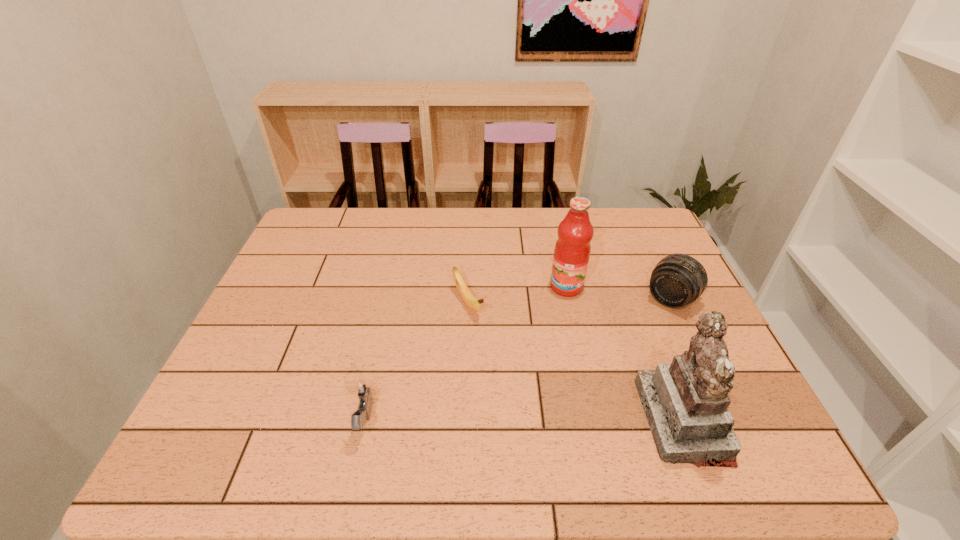
Find the location of a particular element. This screenshot has width=960, height=540. vacant region at the far right corner of the desktop is located at coordinates (627, 245).

The image size is (960, 540). I want to click on vacant space at the near right corner, so click(751, 420).

Where is `vacant area that lies between the third tallest object and the leftmost object`? This screenshot has height=540, width=960. vacant area that lies between the third tallest object and the leftmost object is located at coordinates (517, 361).

At what (x,y) coordinates should I click in order to perform the action: click on free space between the third tallest object and the fourth tallest object. Please return your answer as a coordinate pair (x, y). Image resolution: width=960 pixels, height=540 pixels. Looking at the image, I should click on (517, 361).

Identify the location of vacant space that's between the leftmost object and the telephoto lens. The image size is (960, 540). (517, 361).

This screenshot has width=960, height=540. Find the location of `vacant space that is in between the third object from left to right and the fourth object from right to left`. vacant space that is in between the third object from left to right and the fourth object from right to left is located at coordinates (517, 295).

The image size is (960, 540). What are the coordinates of `empty space between the igniter and the fourth object from right to left` in the screenshot? It's located at (417, 362).

Find the location of `empty space between the fourth object from right to left and the figurine`. empty space between the fourth object from right to left and the figurine is located at coordinates (575, 362).

The width and height of the screenshot is (960, 540). What are the coordinates of `vacant point located between the third object from left to right and the telephoto lens` in the screenshot? It's located at (618, 293).

In order to click on free spot between the shortest object and the telephoto lens in this screenshot , I will do `click(569, 301)`.